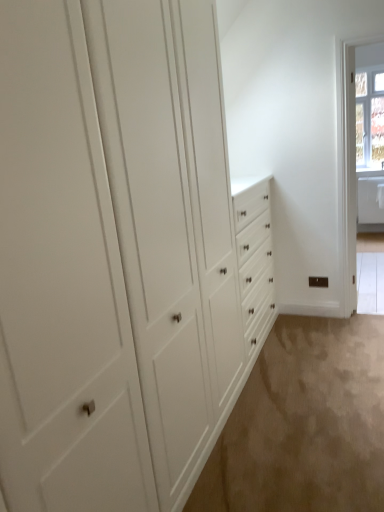
Question: Considering their positions, is beige carpet at lower right located in front of or behind clear glass window at upper right?

Choices:
 (A) front
 (B) behind

Answer: (A)

Question: Is beige carpet at lower right taller or shorter than clear glass window at upper right?

Choices:
 (A) tall
 (B) short

Answer: (B)

Question: From a real-world perspective, relative to clear glass window at upper right, is beige carpet at lower right vertically above or below?

Choices:
 (A) below
 (B) above

Answer: (A)

Question: From their relative heights in the image, would you say clear glass window at upper right is taller or shorter than beige carpet at lower right?

Choices:
 (A) tall
 (B) short

Answer: (A)

Question: Which is correct: clear glass window at upper right is inside beige carpet at lower right, or outside of it?

Choices:
 (A) outside
 (B) inside

Answer: (A)

Question: From the image's perspective, relative to beige carpet at lower right, is clear glass window at upper right above or below?

Choices:
 (A) below
 (B) above

Answer: (B)

Question: Considering the positions of clear glass window at upper right and beige carpet at lower right in the image, is clear glass window at upper right bigger or smaller than beige carpet at lower right?

Choices:
 (A) big
 (B) small

Answer: (B)